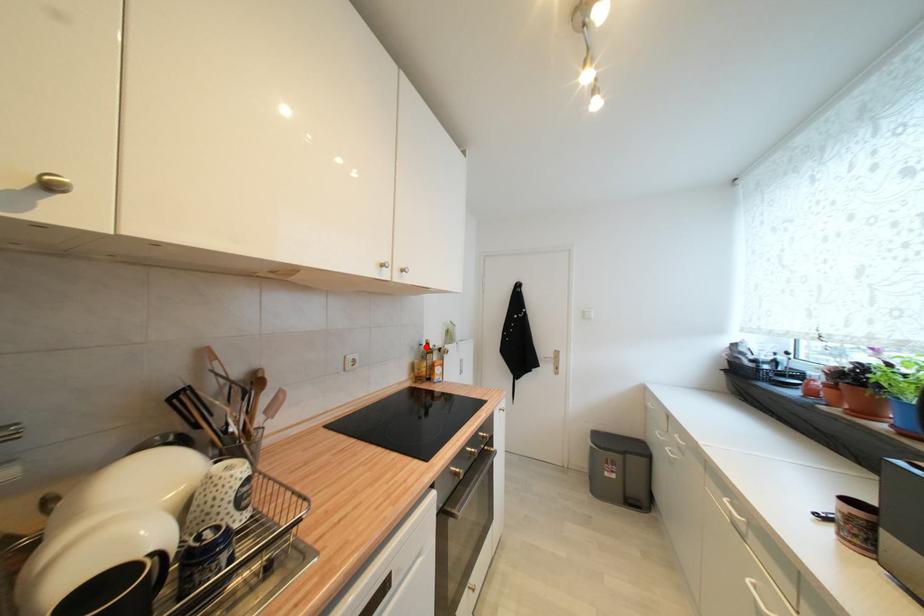
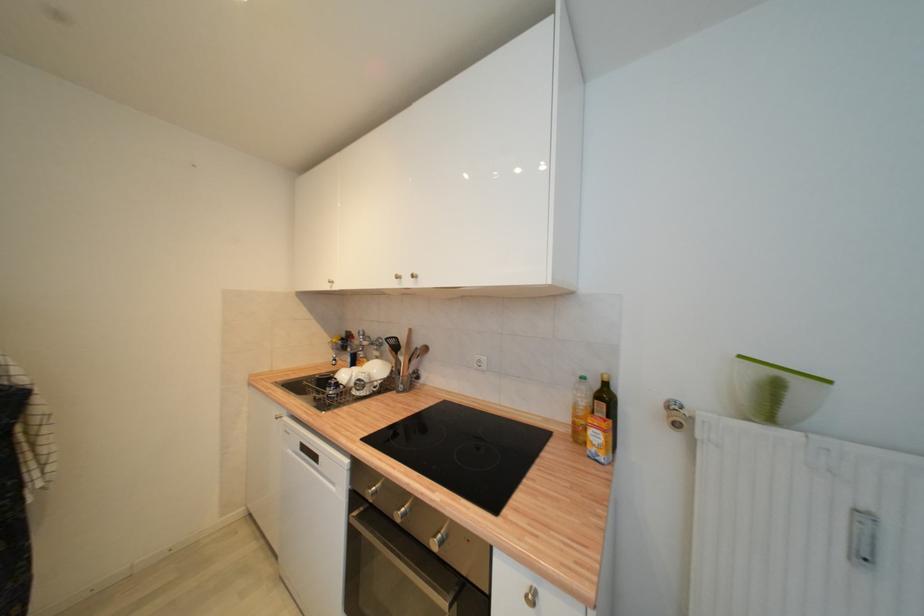
In the second image, find the point that corresponds to the highlighted location in the first image.

(586, 379)